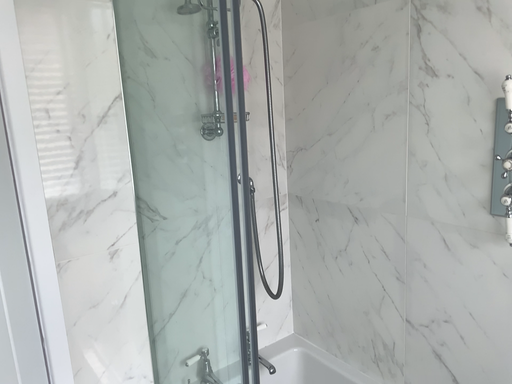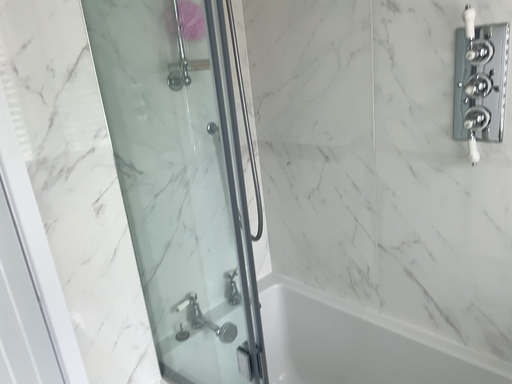
Question: Which way did the camera rotate in the video?

Choices:
 (A) rotated right
 (B) rotated left

Answer: (A)